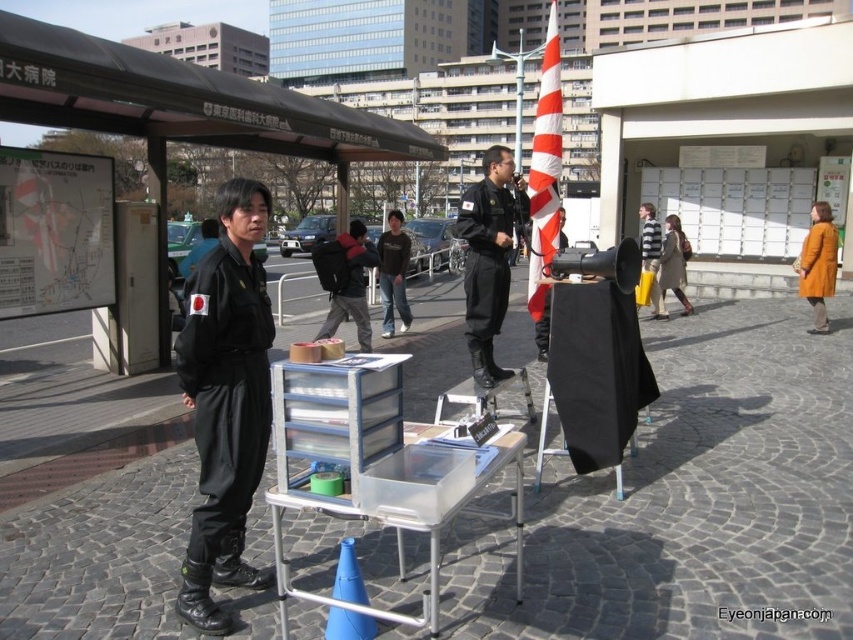
You are a tourist in Japan and want to take a photo of the bus stop signboard. You are standing at point (538, 112). If you walk towards point (480, 262), will you get closer to the bus stop signboard?

Yes, because point (480, 262) is in front of point (538, 112), so moving towards it would bring you closer to the bus stop signboard.

You are a delivery person trying to place a large package on the ground. The cobblestone pavement at center and the dark blue denim jeans at center are both visible. Which surface would you choose to place the package to ensure stability?

The cobblestone pavement at center is larger in size than the dark blue denim jeans at center, so placing the package on the cobblestone pavement at center would provide a more stable and level surface for the package.